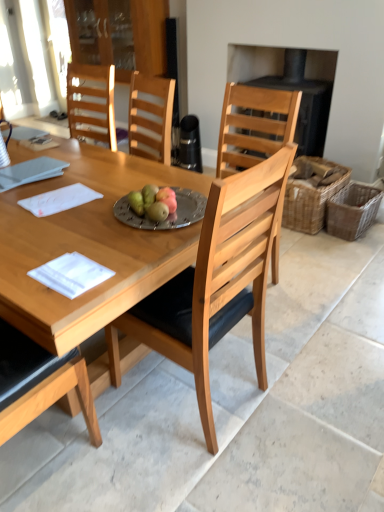
Find the location of `vacant location behind silver metallic plate at center`. vacant location behind silver metallic plate at center is located at coordinates (157, 179).